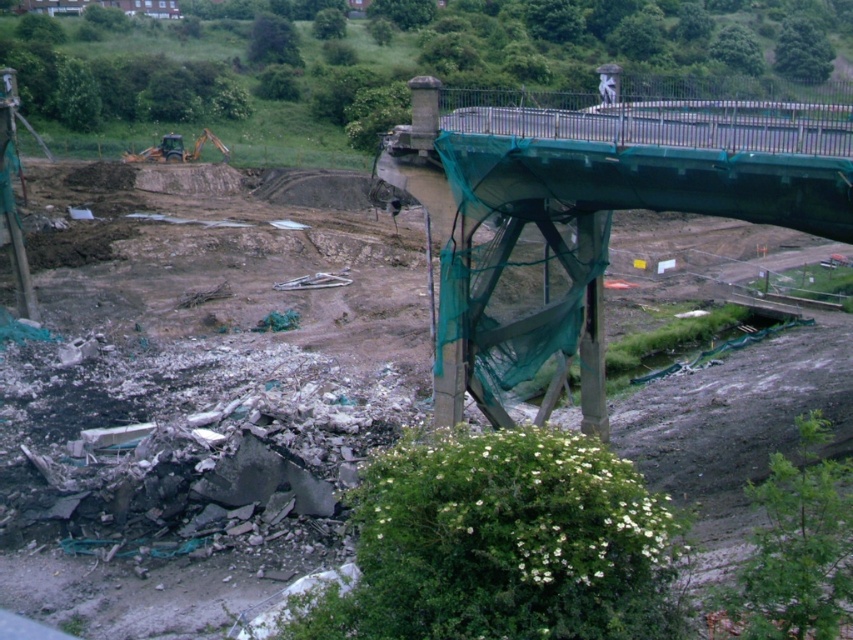
Question: Is green fabric-covered bridge at upper right positioned before green rubber excavator at left?

Choices:
 (A) no
 (B) yes

Answer: (B)

Question: Which object appears closest to the camera in this image?

Choices:
 (A) green rubber excavator at left
 (B) green fabric-covered bridge at upper right

Answer: (B)

Question: Among these points, which one is nearest to the camera?

Choices:
 (A) (167, 134)
 (B) (431, 124)

Answer: (B)

Question: Is green fabric-covered bridge at upper right above green rubber excavator at left?

Choices:
 (A) yes
 (B) no

Answer: (B)

Question: Is green fabric-covered bridge at upper right closer to camera compared to green rubber excavator at left?

Choices:
 (A) no
 (B) yes

Answer: (B)

Question: Among these points, which one is nearest to the camera?

Choices:
 (A) (637, 128)
 (B) (195, 148)

Answer: (A)